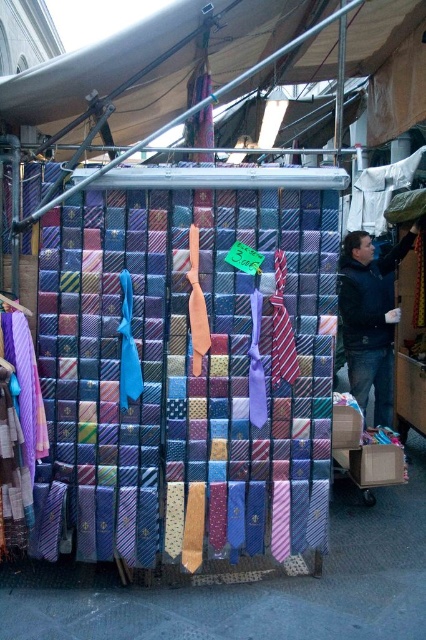
You are a customer at the market stall and want to locate the textured silk tie at center. According to the scene, where is it positioned relative to the beige fabric canopy at upper center?

The textured silk tie at center is to the left of the beige fabric canopy at upper center.

You are a customer at the market stall looking to buy a tie. You notice the textured silk tie at center and the matte purple tie at left. Which tie is positioned lower on the rack?

The textured silk tie at center is positioned lower on the rack as it is below the matte purple tie at left.